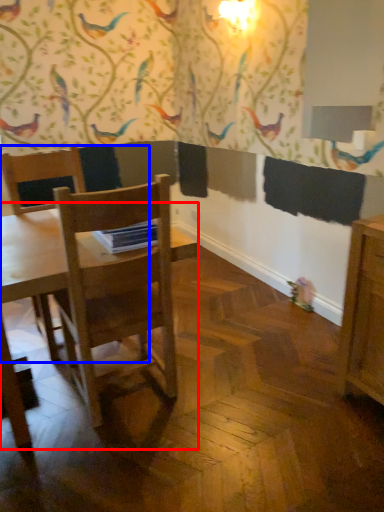
Question: Which object is closer to the camera taking this photo, table (highlighted by a red box) or chair (highlighted by a blue box)?

Choices:
 (A) table
 (B) chair

Answer: (A)